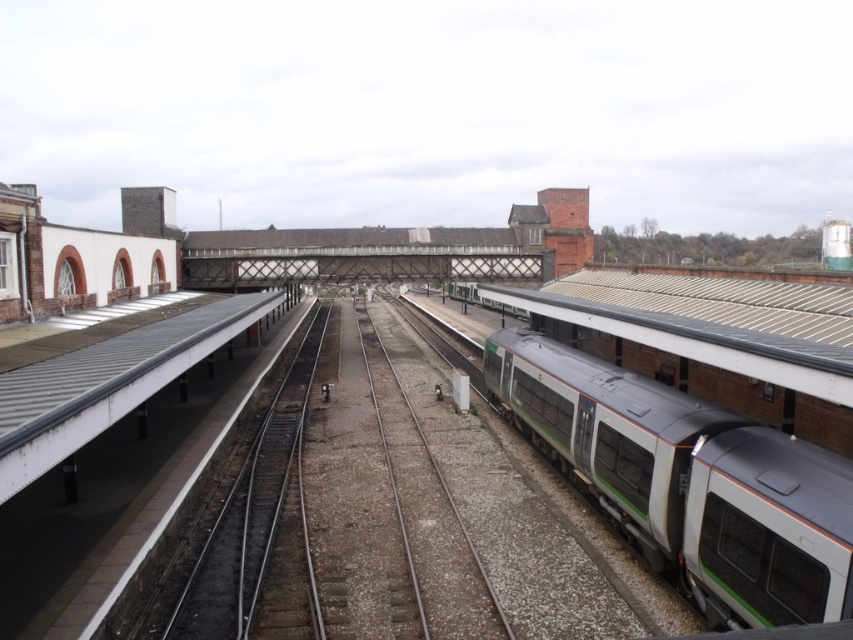
Can you confirm if smooth concrete platform at center is wider than green metallic train at right?

Indeed, smooth concrete platform at center has a greater width compared to green metallic train at right.

Describe the element at coordinates (401, 502) in the screenshot. I see `smooth concrete platform at center` at that location.

Between point (469, 513) and point (689, 508), which one is positioned in front?

Point (689, 508) is in front.

Find the location of a particular element. The image size is (853, 640). smooth concrete platform at center is located at coordinates (401, 502).